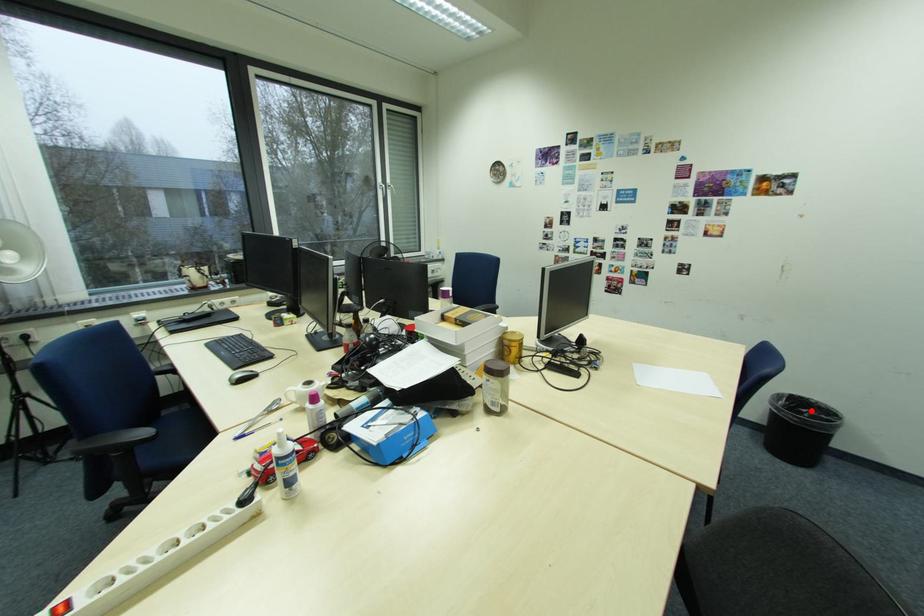
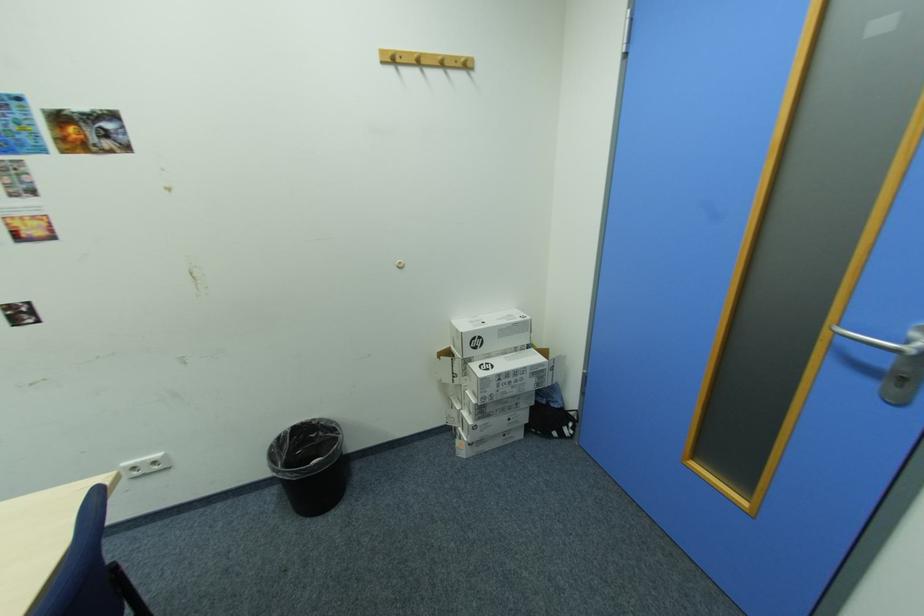
The point at the highlighted location is marked in the first image. Where is the corresponding point in the second image?

(322, 436)